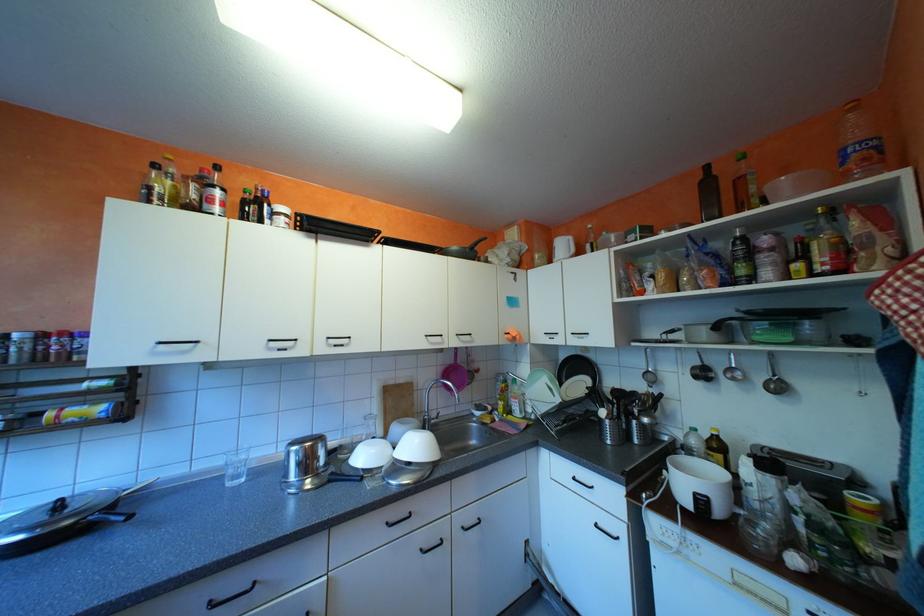
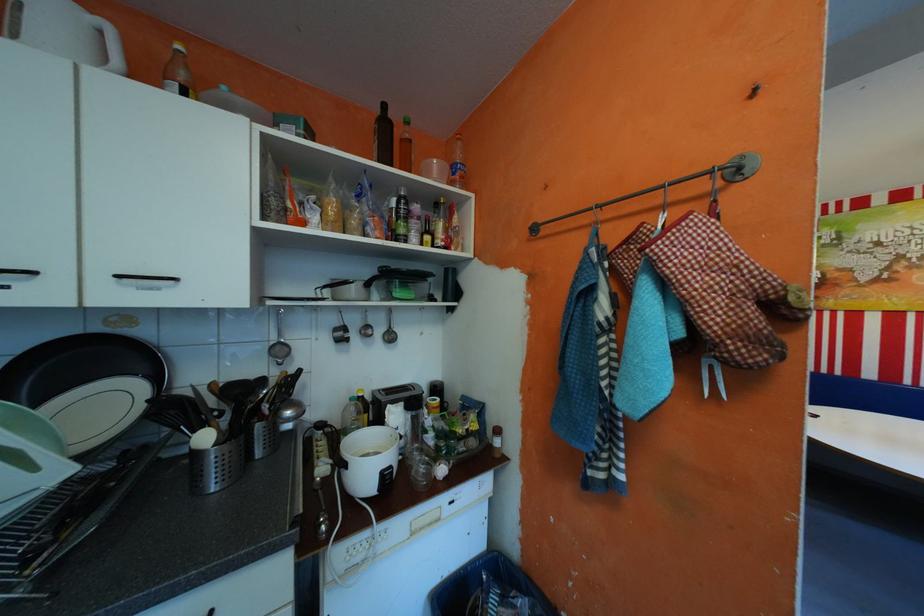
Where in the second image is the point corresponding to (x=662, y=374) from the first image?

(289, 346)